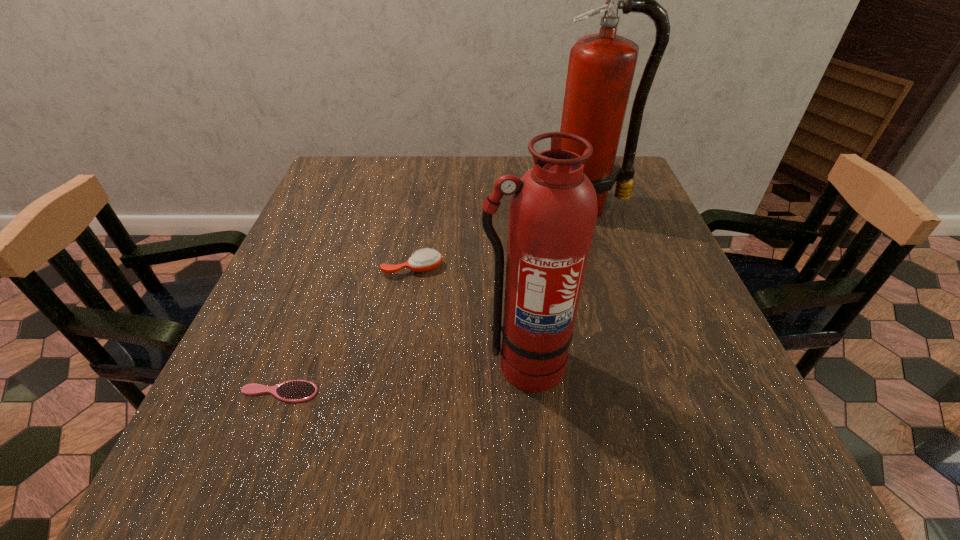
What are the coordinates of `free region located 0.170m on the back of the taller hairbrush` in the screenshot? It's located at (421, 214).

The width and height of the screenshot is (960, 540). I want to click on free space located on the back of the left hairbrush, so point(326,268).

You are a GUI agent. You are given a task and a screenshot of the screen. Output one action in this format:
    pyautogui.click(x=<x>, y=<y>)
    Task: Click on the object that is at the far edge
    The height and width of the screenshot is (540, 960).
    Given the screenshot: What is the action you would take?
    pyautogui.click(x=601, y=67)

Where is `object present at the left edge`? The image size is (960, 540). object present at the left edge is located at coordinates (294, 391).

Where is `object at the right edge`? The height and width of the screenshot is (540, 960). object at the right edge is located at coordinates [601, 67].

Locate an element on the screen. object present at the far right corner is located at coordinates (601, 67).

This screenshot has width=960, height=540. Identify the location of vacant area at the far edge. (407, 161).

Find the location of a particular element. free location at the left edge of the desktop is located at coordinates (329, 298).

Find the location of a particular element. vacant space at the right edge is located at coordinates (650, 206).

You are a GUI agent. You are given a task and a screenshot of the screen. Output one action in this format:
    pyautogui.click(x=<x>, y=<y>)
    Task: Click on the vacant point at the far left corner
    
    Given the screenshot: What is the action you would take?
    pyautogui.click(x=386, y=163)